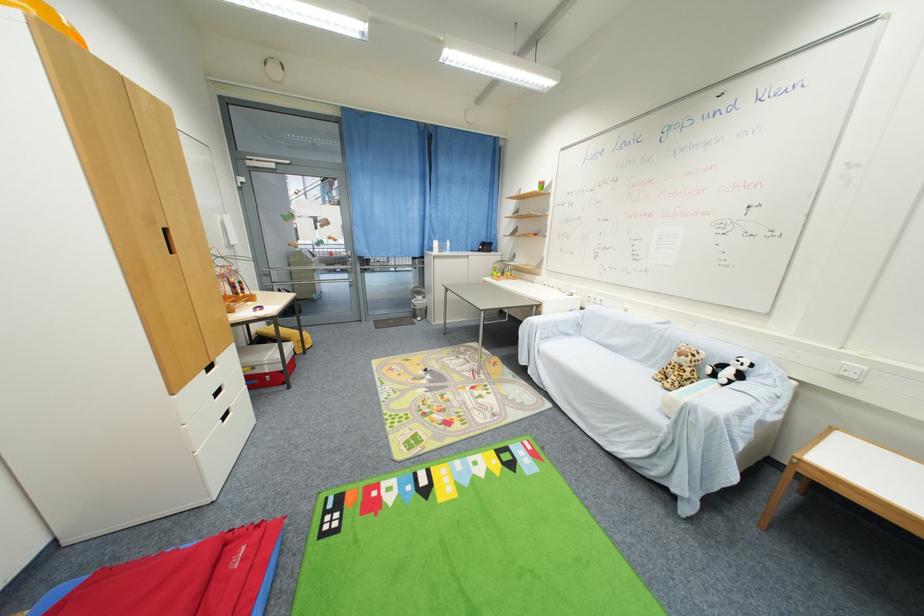
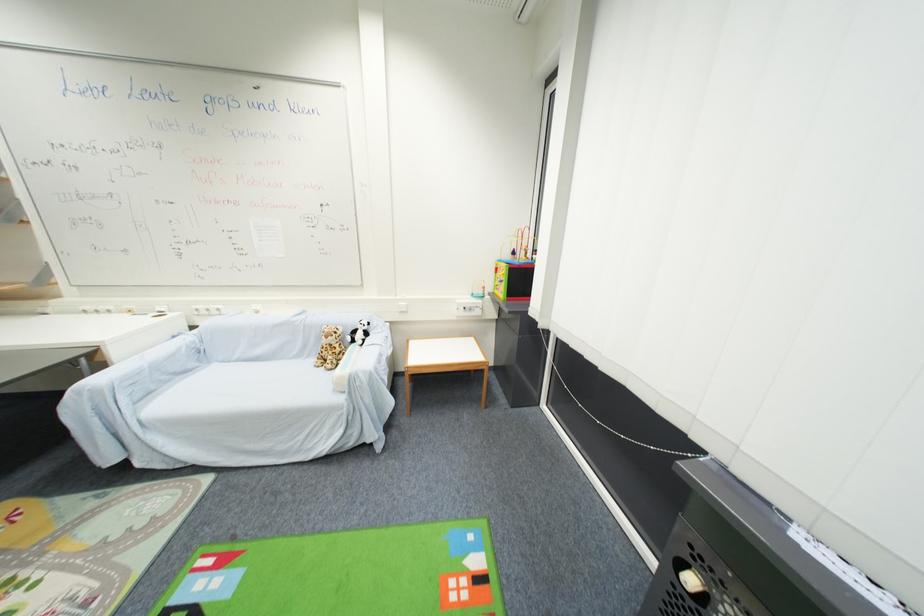
Question: The camera is either moving clockwise (left) or counter-clockwise (right) around the object. The first image is from the beginning of the video and the second image is from the end. Is the camera moving left or right when shooting the video?

Choices:
 (A) Left
 (B) Right

Answer: (A)